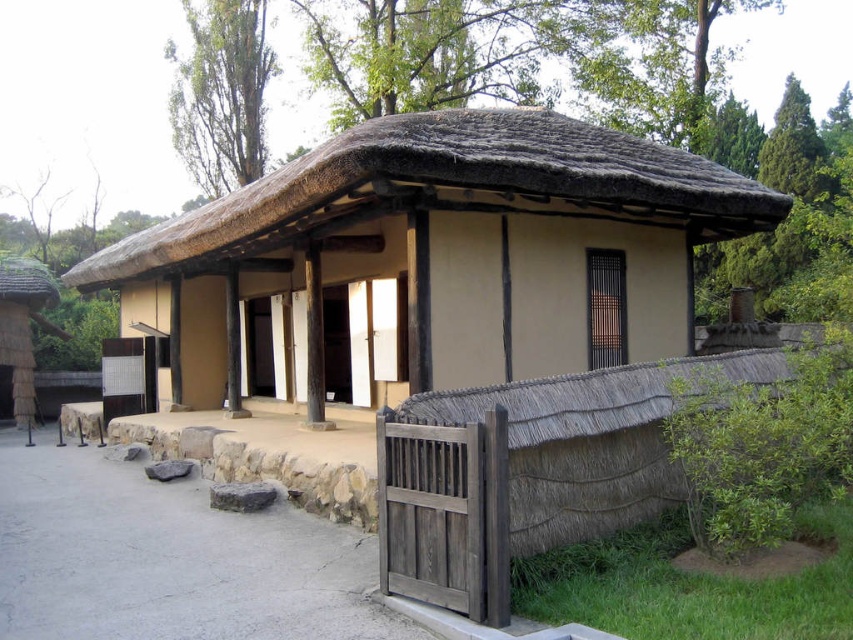
Based on the photo, you are standing in front of the traditional Korean house and want to enter through the entrance. Which object should you approach first, the beige thatched roof hut at center or the thatched straw roof at center, to reach the entrance?

You should approach the thatched straw roof at center first because the beige thatched roof hut at center is to the right of it, meaning the thatched straw roof at center is closer to the entrance on the left side.

What object is located at the coordinates point (428, 262) in the traditional Korean house scene?

The point (428, 262) indicates the beige thatched roof hut at center.